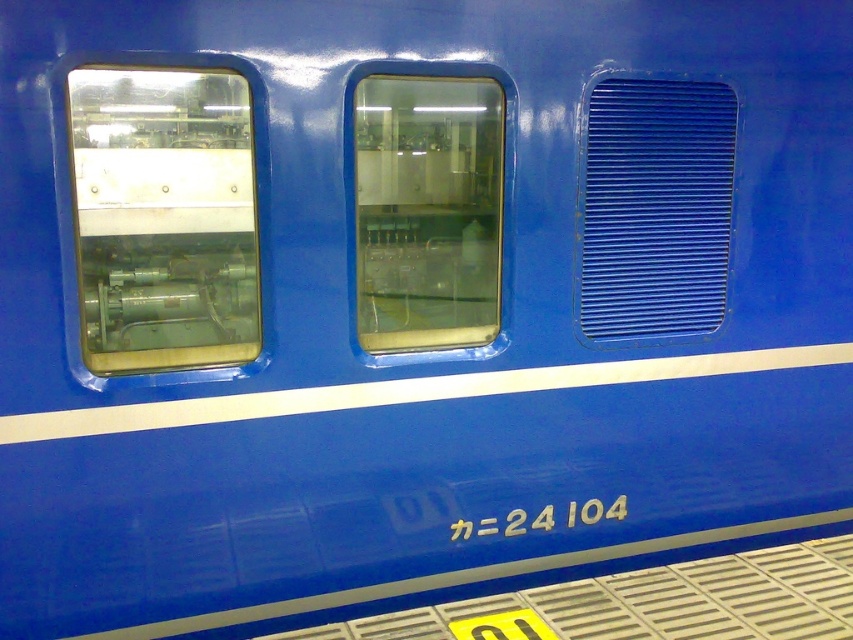
You are standing directly in front of the blue train car and want to look through the transparent glass window at center. Based on its 2D coordinates, where should you aim your gaze relative to the train car?

The transparent glass window at center is located at the 2D coordinates point [427,211], so you should aim your gaze towards the lower left side of the train car.

You are a passenger on the blue train car and want to look outside through the transparent glass window at left and the transparent glass window at center. Which window allows you to see more of the landscape below?

The transparent glass window at center allows you to see more of the landscape below because it is taller than the transparent glass window at left.